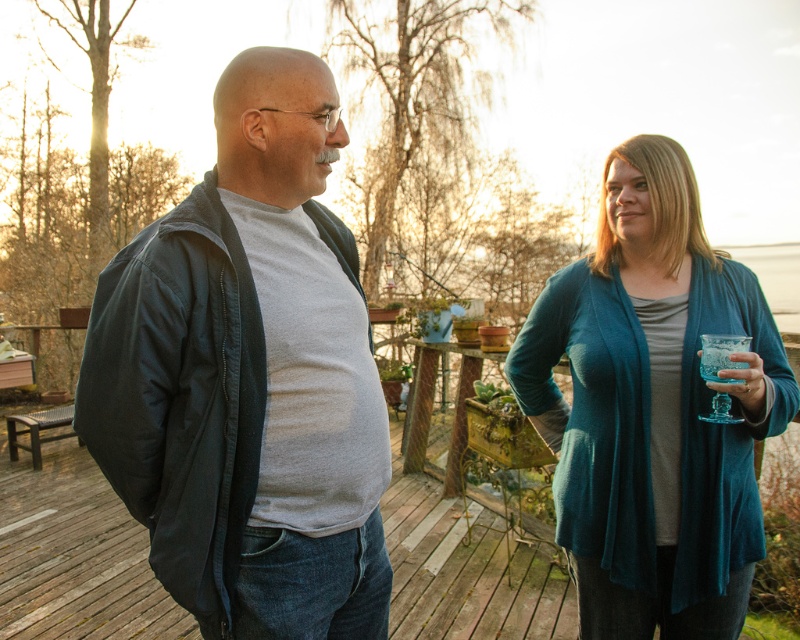
Question: Does matte black jacket at left appear on the left side of teal knit cardigan at right?

Choices:
 (A) yes
 (B) no

Answer: (A)

Question: Which object appears farthest from the camera in this image?

Choices:
 (A) teal knit cardigan at right
 (B) matte black jacket at left

Answer: (A)

Question: Can you confirm if matte black jacket at left is thinner than teal knit cardigan at right?

Choices:
 (A) yes
 (B) no

Answer: (A)

Question: Is matte black jacket at left below teal knit cardigan at right?

Choices:
 (A) yes
 (B) no

Answer: (B)